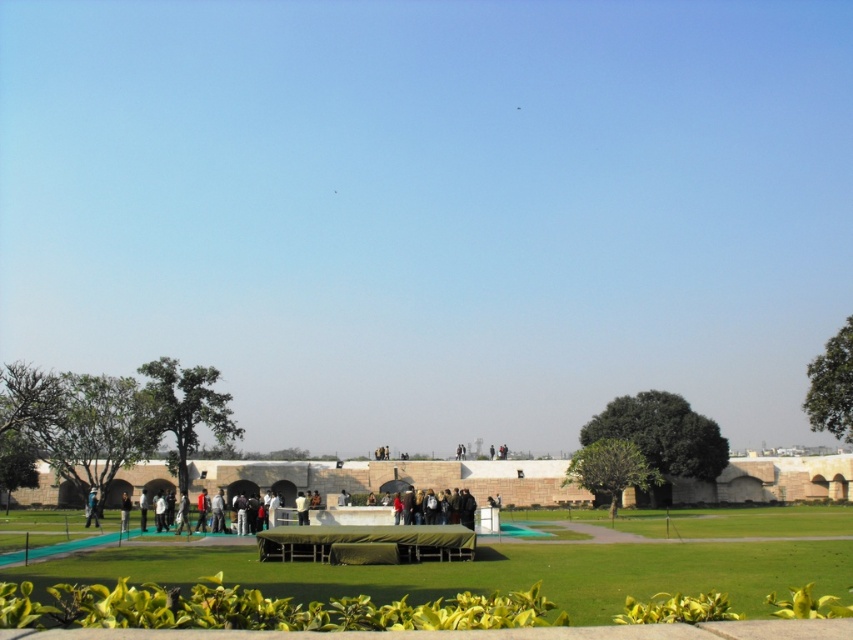
Question: Which point appears closest to the camera in this image?

Choices:
 (A) (531, 554)
 (B) (125, 497)

Answer: (A)

Question: Which object is positioned closest to the light gray fabric at center?

Choices:
 (A) dark gray fabric at center
 (B) green grass at center
 (C) dark gray jacket at center

Answer: (C)

Question: Which object is positioned closest to the white fabric at center?

Choices:
 (A) dark gray fabric at center
 (B) light gray fabric at center
 (C) dark gray jacket at center
 (D) green grass at center

Answer: (A)

Question: Is green grass at center to the left of dark gray jacket at center from the viewer's perspective?

Choices:
 (A) no
 (B) yes

Answer: (A)

Question: Does dark gray fabric at center have a larger size compared to light blue fabric at center?

Choices:
 (A) yes
 (B) no

Answer: (B)

Question: Is light blue fabric at center to the right of light gray fabric at center from the viewer's perspective?

Choices:
 (A) no
 (B) yes

Answer: (A)